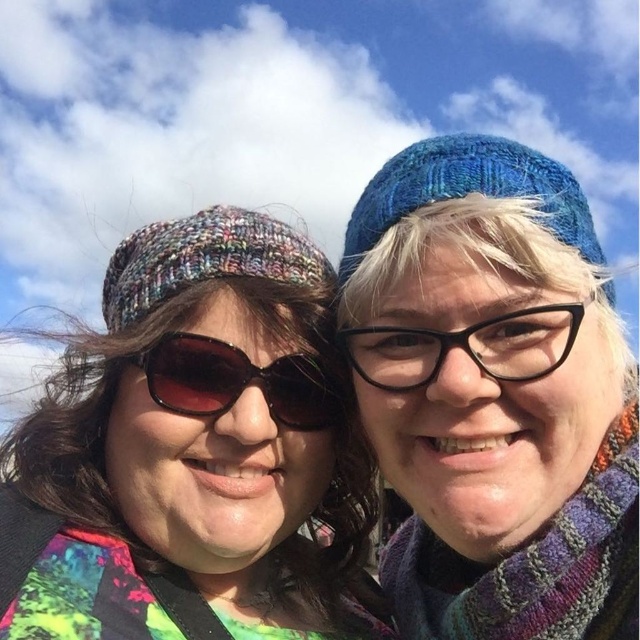
Question: Based on their relative distances, which object is nearer to the black plastic glasses at center?

Choices:
 (A) multicolored knit hat at left
 (B) sunglasses at center
 (C) knitted wool scarf at right
 (D) blue knitted hat at upper center

Answer: (D)

Question: Based on their relative distances, which object is farther from the sunglasses at center?

Choices:
 (A) blue knitted hat at upper right
 (B) knitted wool scarf at right
 (C) black plastic glasses at center

Answer: (B)

Question: Does blue knitted hat at upper right have a greater width compared to multicolored knitted beanie at left?

Choices:
 (A) yes
 (B) no

Answer: (B)

Question: Does blue knitted hat at upper center appear over knitted wool scarf at right?

Choices:
 (A) yes
 (B) no

Answer: (B)

Question: Which object appears farthest from the camera in this image?

Choices:
 (A) blue knitted hat at upper right
 (B) black plastic glasses at center

Answer: (A)

Question: Does multicolored knit hat at left have a lesser width compared to knitted wool scarf at right?

Choices:
 (A) yes
 (B) no

Answer: (B)